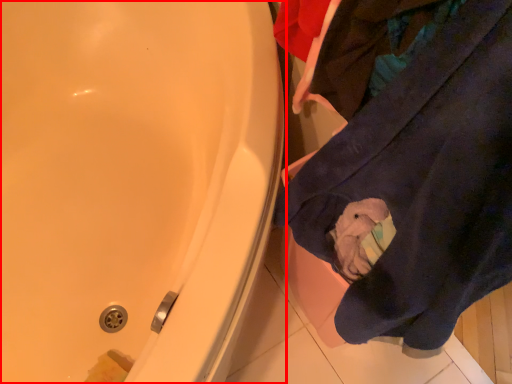
Question: From the image's perspective, considering the relative positions of bathtub (annotated by the red box) and clothing in the image provided, where is bathtub (annotated by the red box) located with respect to the staircase?

Choices:
 (A) above
 (B) below

Answer: (A)